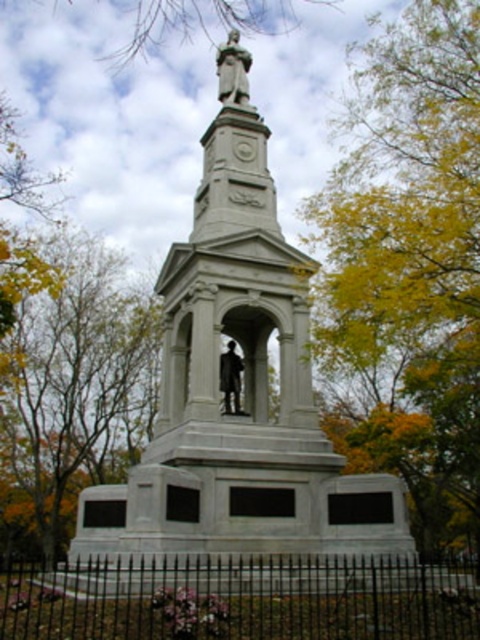
Question: Is yellow leafy tree at upper center positioned behind yellow leafy tree at center?

Choices:
 (A) yes
 (B) no

Answer: (B)

Question: Estimate the real-world distances between objects in this image. Which object is closer to the yellow leafy tree at center?

Choices:
 (A) polished bronze statue at upper center
 (B) polished bronze statue at center

Answer: (A)

Question: Does polished bronze statue at upper center appear under polished bronze statue at center?

Choices:
 (A) no
 (B) yes

Answer: (A)

Question: Estimate the real-world distances between objects in this image. Which object is closer to the white marble statue at center?

Choices:
 (A) polished bronze statue at upper center
 (B) polished bronze statue at center
 (C) yellow leafy tree at center

Answer: (B)

Question: Can you confirm if polished bronze statue at upper center is wider than polished bronze statue at center?

Choices:
 (A) yes
 (B) no

Answer: (A)

Question: Among these objects, which one is farthest from the camera?

Choices:
 (A) white marble statue at center
 (B) polished bronze statue at upper center
 (C) yellow leafy tree at upper center
 (D) polished bronze statue at center

Answer: (B)